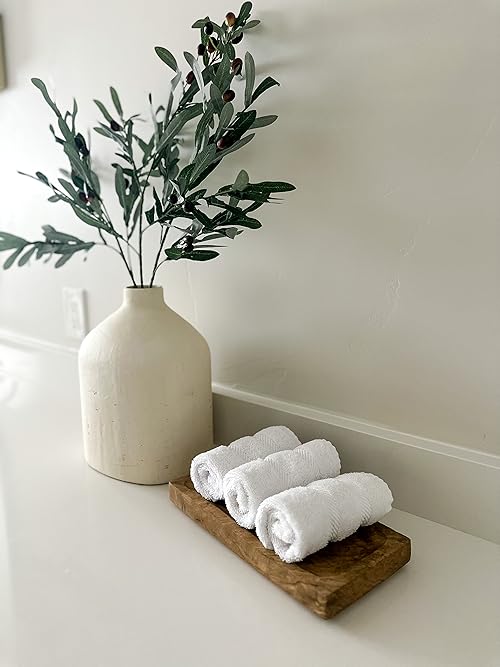
Locate an element on the screen. Image resolution: width=500 pixels, height=667 pixels. hand towels is located at coordinates (305, 502), (282, 474), (249, 455).